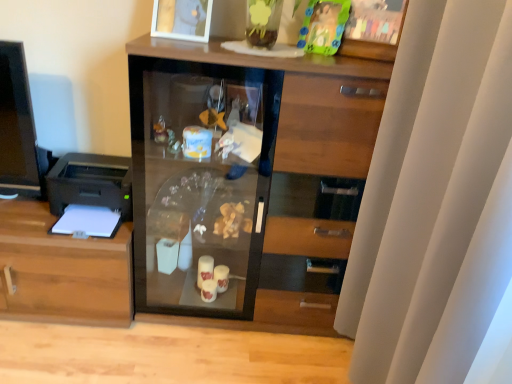
Question: Is black plastic printer at left completely or partially outside of white glossy picture frame at upper center?

Choices:
 (A) no
 (B) yes

Answer: (B)

Question: Is white glossy picture frame at upper center a part of black plastic printer at left?

Choices:
 (A) yes
 (B) no

Answer: (B)

Question: Would you consider black plastic printer at left to be distant from white glossy picture frame at upper center?

Choices:
 (A) yes
 (B) no

Answer: (B)

Question: Does black plastic printer at left turn towards white glossy picture frame at upper center?

Choices:
 (A) no
 (B) yes

Answer: (A)

Question: Are black plastic printer at left and white glossy picture frame at upper center making contact?

Choices:
 (A) no
 (B) yes

Answer: (A)

Question: Considering the positions of white matte curtain at right and white glossy picture frame at upper center in the image, is white matte curtain at right taller or shorter than white glossy picture frame at upper center?

Choices:
 (A) tall
 (B) short

Answer: (A)

Question: Is white matte curtain at right bigger or smaller than white glossy picture frame at upper center?

Choices:
 (A) small
 (B) big

Answer: (B)

Question: Considering the positions of point (460, 321) and point (168, 8), is point (460, 321) closer or farther from the camera than point (168, 8)?

Choices:
 (A) closer
 (B) farther

Answer: (A)

Question: Considering their positions, is white matte curtain at right located in front of or behind white glossy picture frame at upper center?

Choices:
 (A) front
 (B) behind

Answer: (A)

Question: In the image, is transparent glass cabinet at center on the left side or the right side of translucent plastic toy at upper center?

Choices:
 (A) right
 (B) left

Answer: (B)

Question: From the image's perspective, is transparent glass cabinet at center positioned above or below translucent plastic toy at upper center?

Choices:
 (A) below
 (B) above

Answer: (A)

Question: Is transparent glass cabinet at center spatially inside translucent plastic toy at upper center, or outside of it?

Choices:
 (A) outside
 (B) inside

Answer: (A)

Question: Is transparent glass cabinet at center in front of or behind translucent plastic toy at upper center in the image?

Choices:
 (A) behind
 (B) front

Answer: (B)

Question: Is black plastic printer at left taller or shorter than wooden cabinet at left?

Choices:
 (A) tall
 (B) short

Answer: (B)

Question: Considering the positions of black plastic printer at left and wooden cabinet at left in the image, is black plastic printer at left bigger or smaller than wooden cabinet at left?

Choices:
 (A) small
 (B) big

Answer: (A)